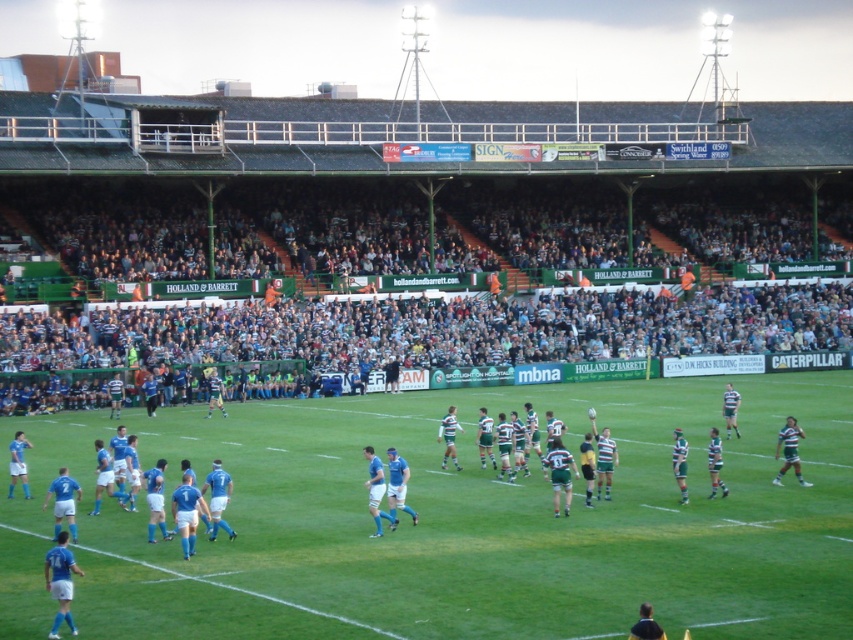
Question: Is green grass field at center to the right of dark gray crowd at upper center from the viewer's perspective?

Choices:
 (A) yes
 (B) no

Answer: (B)

Question: Which point is farther to the camera?

Choices:
 (A) green grass field at center
 (B) dark gray crowd at upper center

Answer: (B)

Question: Is green grass field at center to the right of dark gray crowd at upper center from the viewer's perspective?

Choices:
 (A) no
 (B) yes

Answer: (A)

Question: Can you confirm if green grass field at center is wider than dark gray crowd at upper center?

Choices:
 (A) yes
 (B) no

Answer: (B)